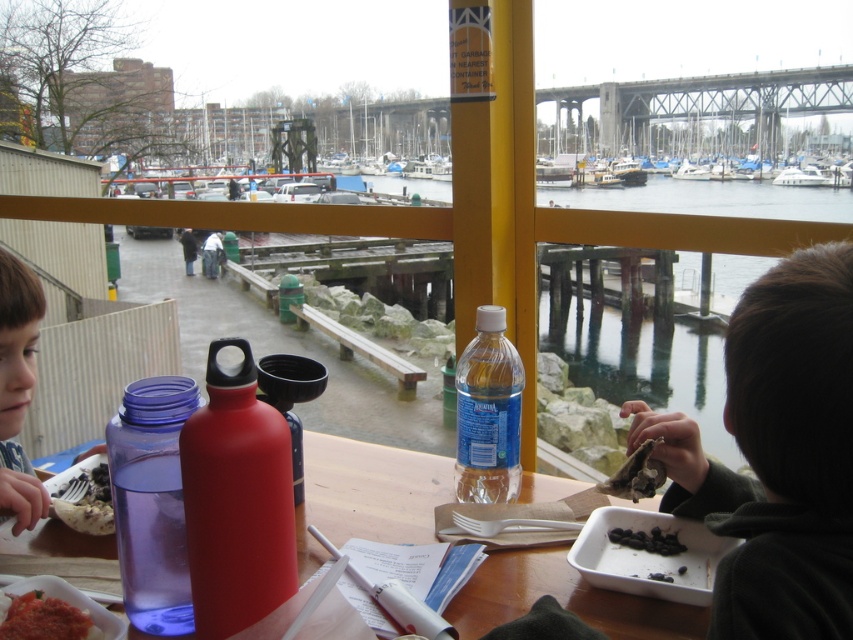
You are a server at the waterfront dining area. You need to place a new order for a customer who is seated at the table with the white cotton shirt at center. Where should you place the dark brown crispy fish at lower right so it doesn t fall off the table?

The dark brown crispy fish at lower right should be placed closer to the edge of the table but not near the lower right area since it is shorter than the white cotton shirt at center, which might block it from falling off.